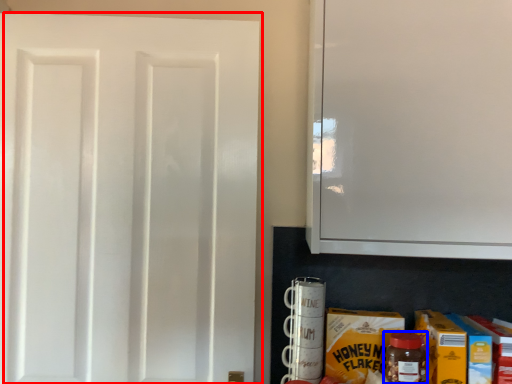
Question: Which object appears farthest to the camera in this image, door (highlighted by a red box) or bottle (highlighted by a blue box)?

Choices:
 (A) door
 (B) bottle

Answer: (A)